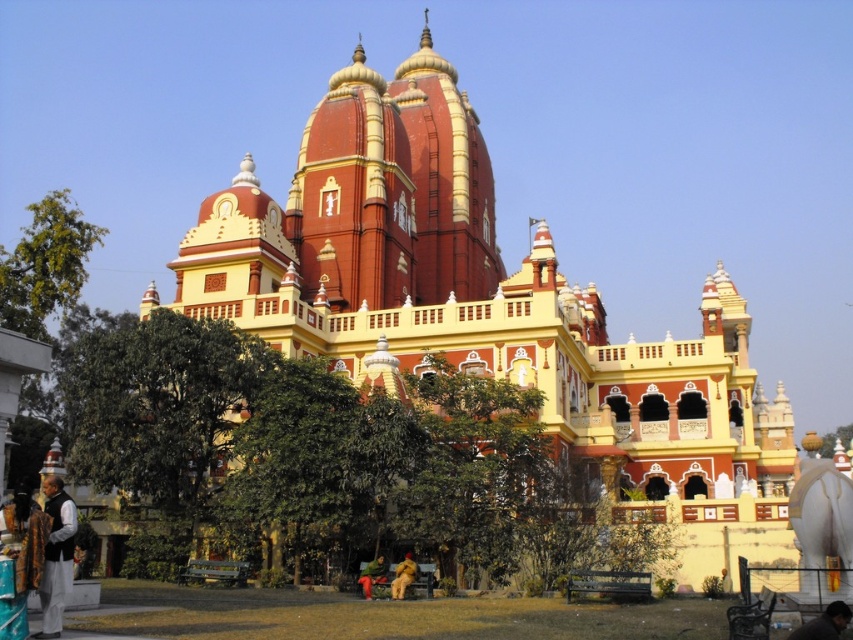
Question: Among these objects, which one is nearest to the camera?

Choices:
 (A) dark brown fabric at lower left
 (B) golden fabric person at lower center

Answer: (A)

Question: Can you confirm if brown fabric jacket at lower right is wider than green fabric cloth at lower center?

Choices:
 (A) no
 (B) yes

Answer: (B)

Question: Does brown fabric jacket at lower right appear under golden fabric person at lower center?

Choices:
 (A) no
 (B) yes

Answer: (A)

Question: Which point appears farthest from the camera in this image?

Choices:
 (A) (47, 477)
 (B) (827, 630)
 (C) (407, 566)
 (D) (379, 570)

Answer: (D)

Question: Considering the real-world distances, which object is closest to the golden fabric person at lower center?

Choices:
 (A) brown fabric jacket at lower right
 (B) dark brown fabric at lower left

Answer: (B)

Question: Can you confirm if dark brown fabric at lower left is wider than green fabric cloth at lower center?

Choices:
 (A) yes
 (B) no

Answer: (B)